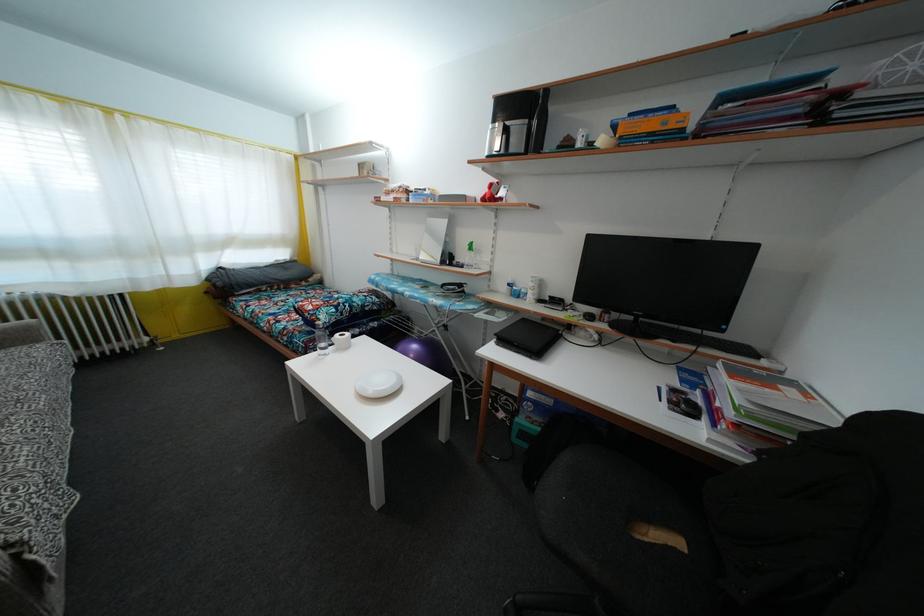
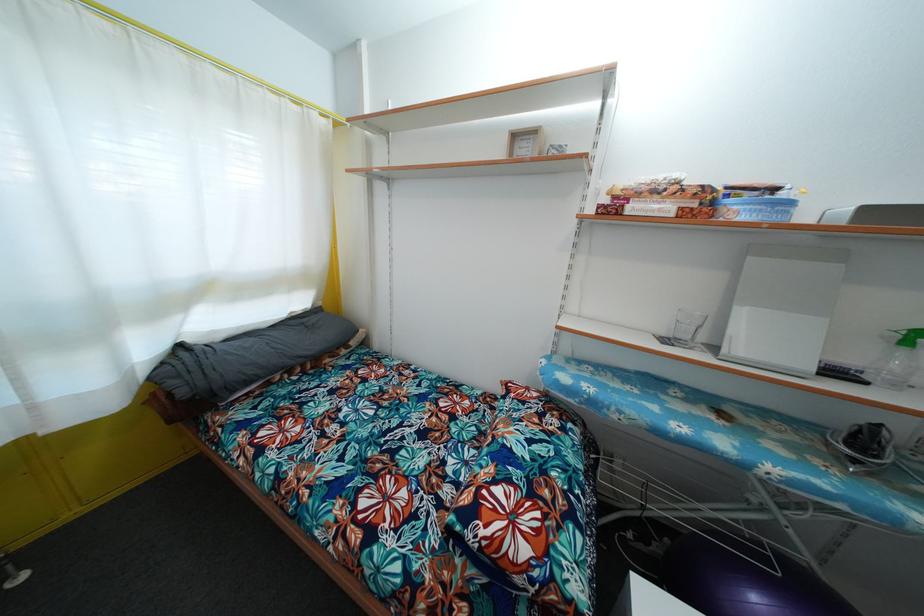
In the second image, find the point that corresponds to point 405,193 in the first image.

(683, 188)